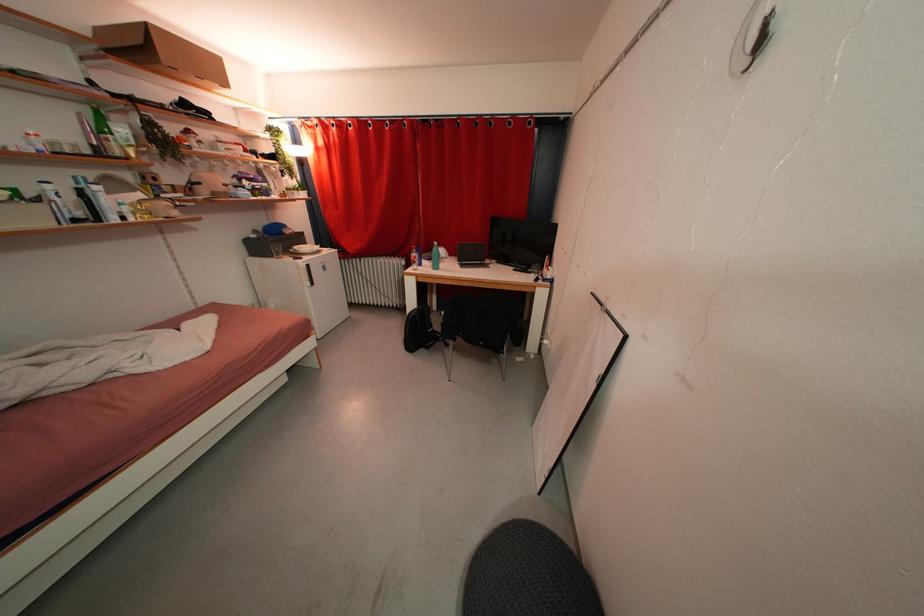
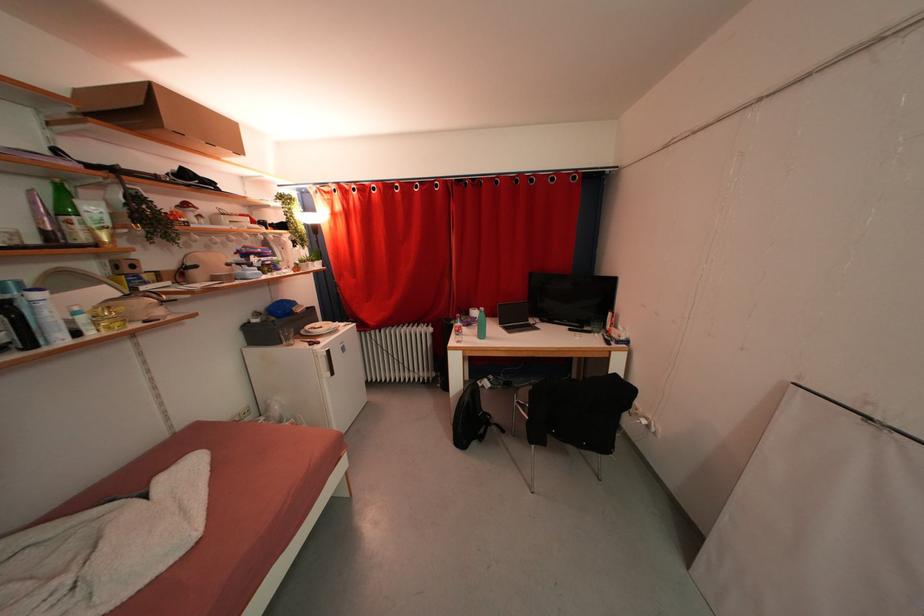
The point at (x=305, y=265) is marked in the first image. Where is the corresponding point in the second image?

(322, 351)